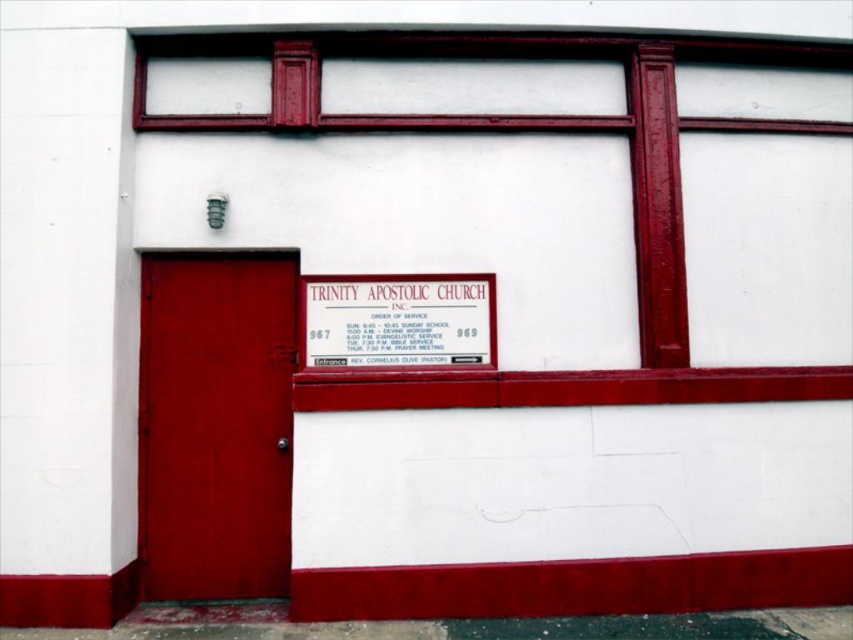
You are standing in front of Trinity Apostolic Church Inc. and notice the matte red door at left and the white matte sign at upper center. Which object is closer to you?

The matte red door at left is closer to you because it is in front of the white matte sign at upper center.

You are a visitor approaching Trinity Apostolic Church Inc. and see the white matte sign at upper center and the metallic gold sign at center. Which sign is bigger?

The white matte sign at upper center is larger than the metallic gold sign at center.

You are a delivery person trying to locate the church office. You see the white matte sign at upper center and the metallic gold sign at center. Which sign is wider?

The white matte sign at upper center is wider than the metallic gold sign at center according to the description.